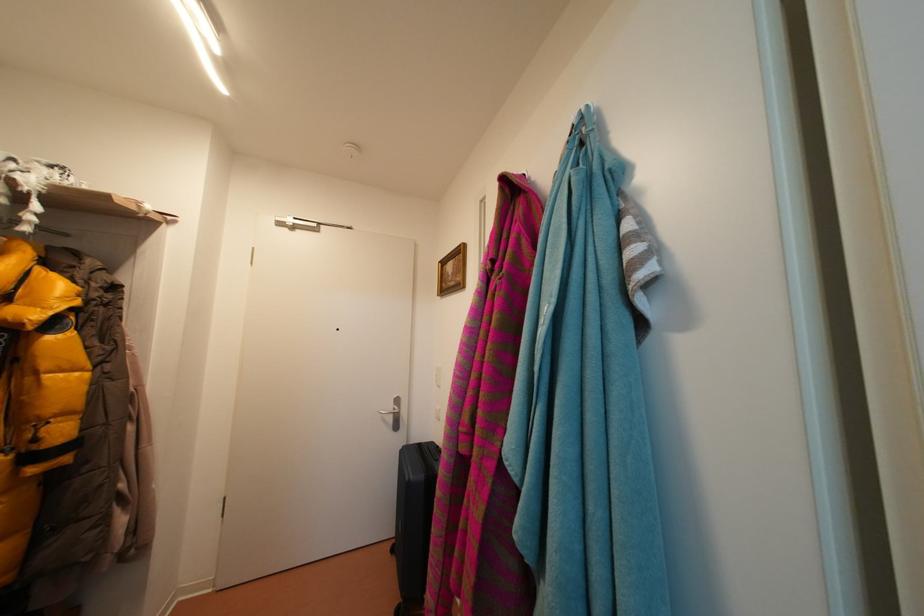
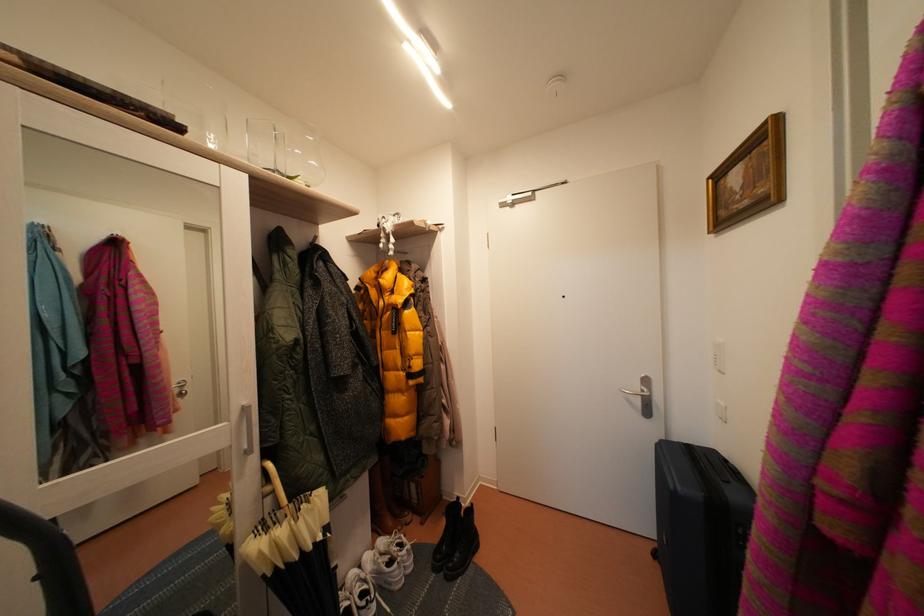
In the second image, find the point that corresponds to (x=399, y=556) in the first image.

(662, 561)